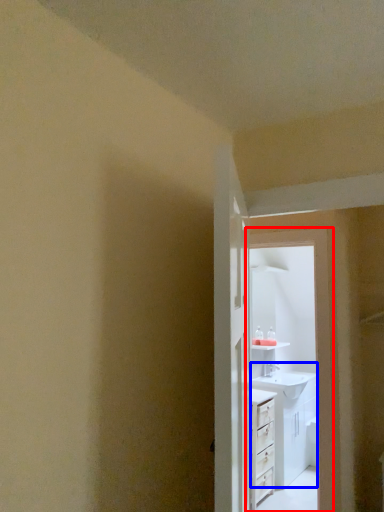
Question: Which object is closer to the camera taking this photo, screen door (highlighted by a red box) or sink (highlighted by a blue box)?

Choices:
 (A) screen door
 (B) sink

Answer: (A)